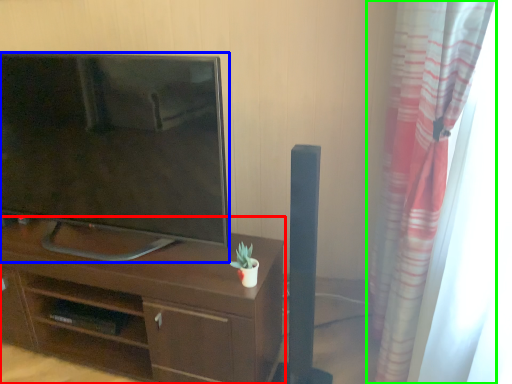
Question: Which object is the farthest from desk (highlighted by a red box)? Choose among these: television (highlighted by a blue box) or curtain (highlighted by a green box).

Choices:
 (A) television
 (B) curtain

Answer: (B)